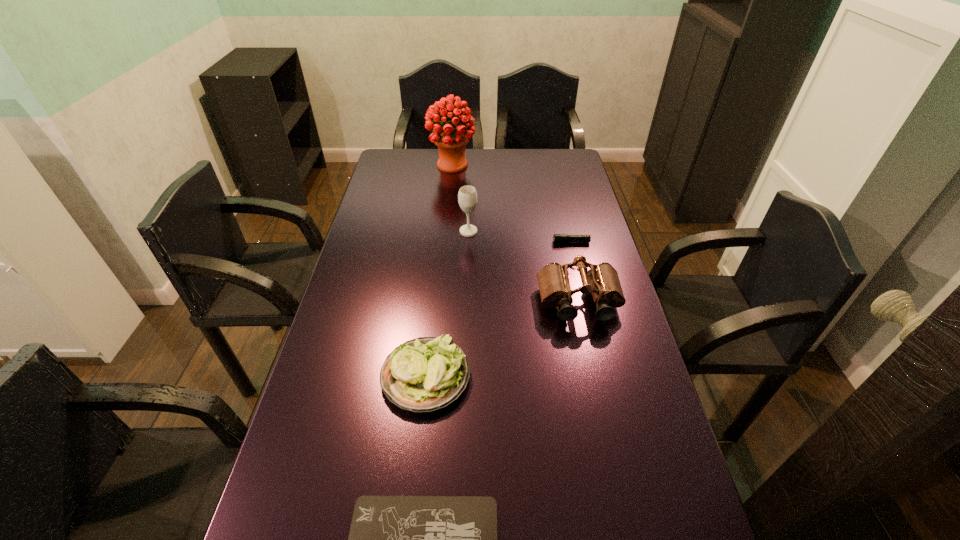
In the image, there is a desktop. What are the coordinates of `vacant space at the left edge` in the screenshot? It's located at (362, 437).

In the image, there is a desktop. At what (x,y) coordinates should I click in order to perform the action: click on vacant space at the right edge. Please return your answer as a coordinate pair (x, y). Looking at the image, I should click on (564, 182).

Identify the location of vacant space at the far right corner. (556, 159).

The height and width of the screenshot is (540, 960). In order to click on vacant area that lies between the flashlight and the bouquet in this screenshot , I will do `click(512, 204)`.

At what (x,y) coordinates should I click in order to perform the action: click on empty space between the lettuce and the fourth farthest object. Please return your answer as a coordinate pair (x, y). Image resolution: width=960 pixels, height=540 pixels. Looking at the image, I should click on (502, 340).

Locate an element on the screen. The width and height of the screenshot is (960, 540). unoccupied position between the lettuce and the third farthest object is located at coordinates click(x=498, y=309).

Where is `free spot between the fifth shortest object and the flashlight`? Image resolution: width=960 pixels, height=540 pixels. free spot between the fifth shortest object and the flashlight is located at coordinates (520, 237).

At what (x,y) coordinates should I click in order to perform the action: click on free spot between the wineglass and the second nearest object. Please return your answer as a coordinate pair (x, y). The height and width of the screenshot is (540, 960). Looking at the image, I should click on (447, 304).

Find the location of a particular element. The width and height of the screenshot is (960, 540). vacant space that's between the flashlight and the binoculars is located at coordinates (575, 272).

Find the location of a particular element. the closest object relative to the farthest object is located at coordinates (467, 196).